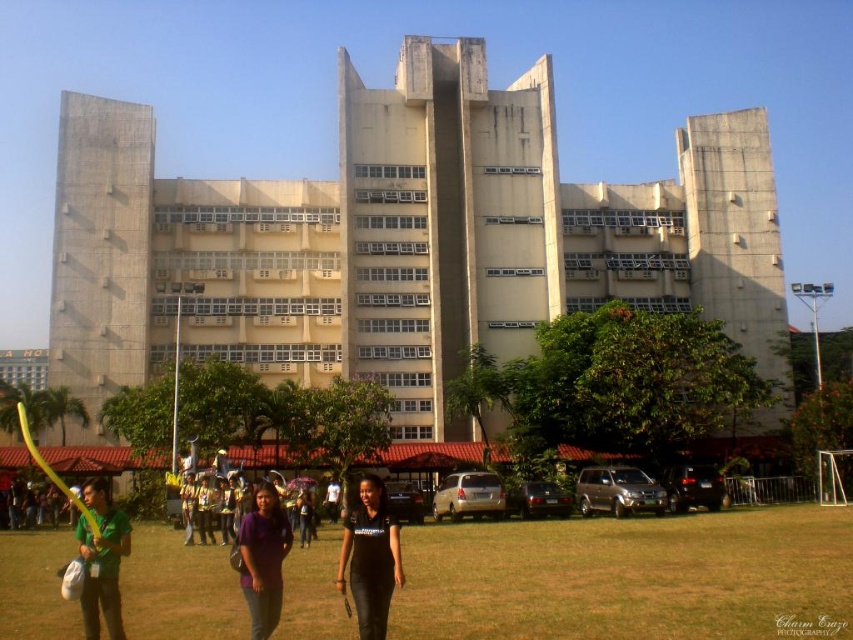
You are standing in the grassy area in front of the building and see both the black leather pants at center and the purple fabric umbrella at center. Which object is closer to you?

The black leather pants at center is closer to you because it is in front of the purple fabric umbrella at center.

You are standing at the point closest to the building. Which point, point (421, 602) or point (108, 518), is farther away from you?

Point (421, 602) is behind point (108, 518), so it is farther away from you.